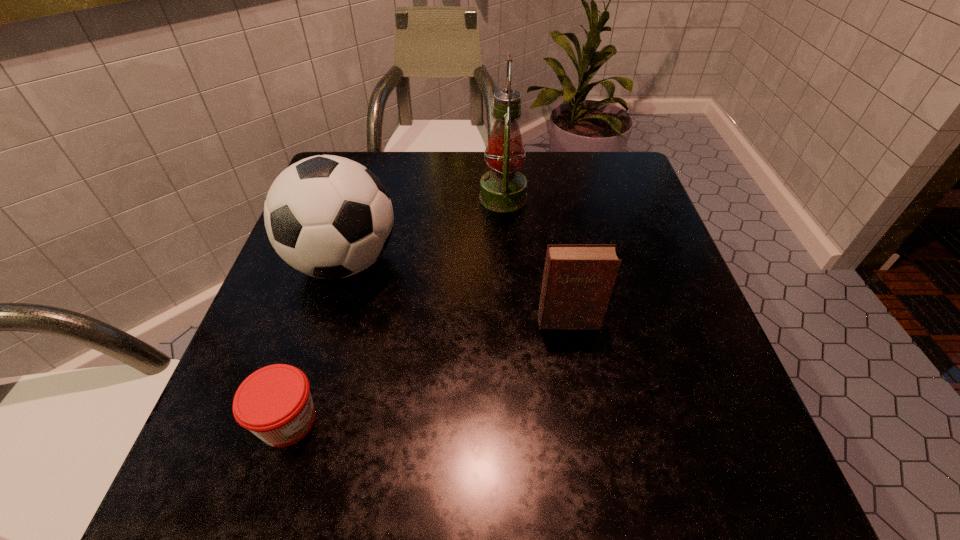
The image size is (960, 540). I want to click on vacant space that's between the second farthest object and the tallest object, so click(x=423, y=230).

Identify the location of vacant area that lies between the third farthest object and the jam. (428, 371).

This screenshot has height=540, width=960. I want to click on free space between the third farthest object and the third nearest object, so click(x=456, y=292).

In order to click on the third closest object to the jam in this screenshot , I will do `click(503, 189)`.

I want to click on object that is the third nearest to the third farthest object, so click(x=274, y=403).

The image size is (960, 540). I want to click on free spot that satisfies the following two spatial constraints: 1. on the front side of the farthest object; 2. on the label side of the nearest object, so click(516, 421).

The height and width of the screenshot is (540, 960). In order to click on vacant point that satisfies the following two spatial constraints: 1. on the front side of the oil lamp; 2. on the label side of the nearest object in this screenshot , I will do `click(516, 421)`.

Identify the location of free space in the image that satisfies the following two spatial constraints: 1. on the front cover of the third tallest object; 2. on the label side of the nearest object. The image size is (960, 540). (586, 421).

Locate an element on the screen. The image size is (960, 540). blank area in the image that satisfies the following two spatial constraints: 1. on the front cover of the diary; 2. on the label side of the jam is located at coordinates [x=586, y=421].